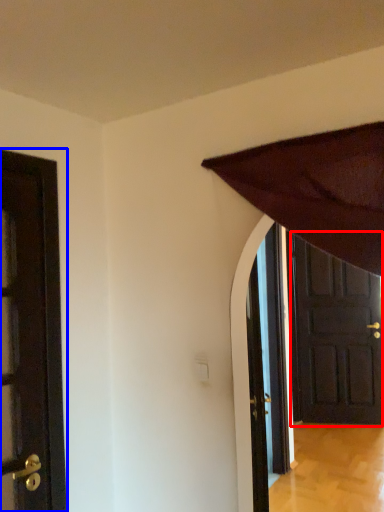
Question: Which point is closer to the camera, door (highlighted by a red box) or door (highlighted by a blue box)?

Choices:
 (A) door
 (B) door

Answer: (B)